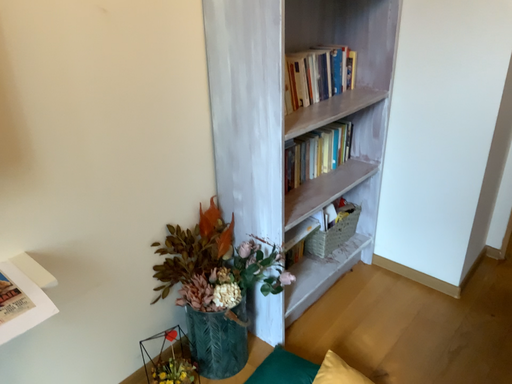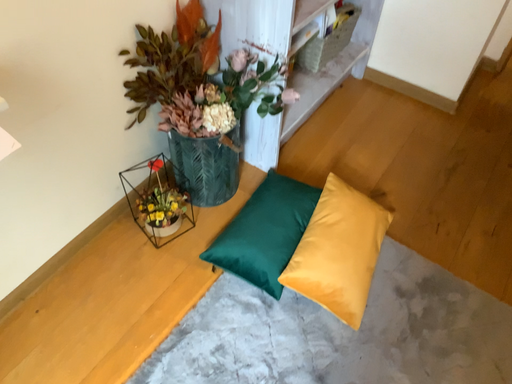
Question: Which way did the camera rotate in the video?

Choices:
 (A) rotated upward
 (B) rotated downward

Answer: (B)